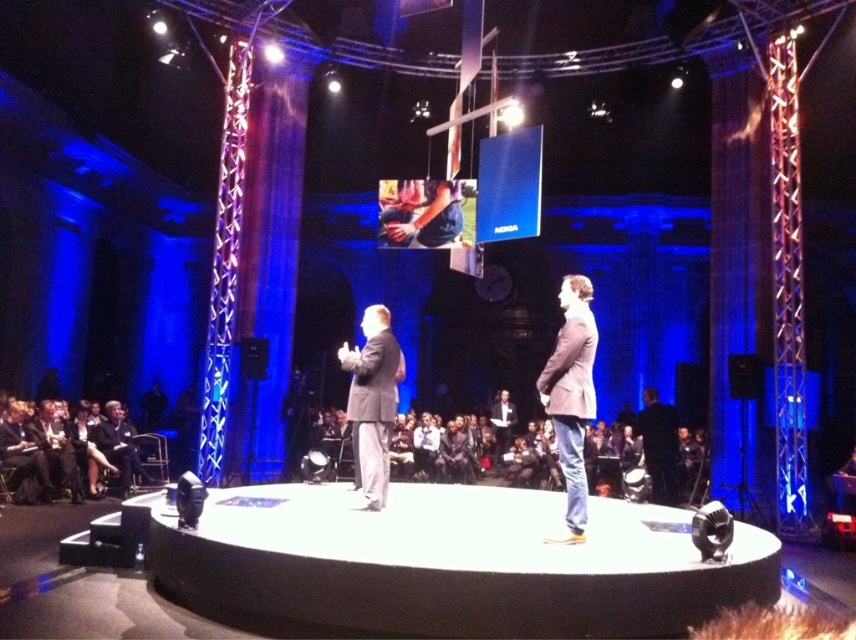
You are an event coordinator planning to place two decorative vases on the stage. You have two specific spots marked as point (566,592) and point (348,412). Which point is closer to the front edge of the stage where the presenter is standing?

Point (566,592) is closer to the viewer than point (348,412), so the vase placed at point (566,592) will be closer to the front edge of the stage where the presenter is standing.

You are standing in the auditorium and want to walk onto the white smooth stage at center. What direction should you move in to reach it?

Since the white smooth stage at center is located at coordinates approximately 0.883 on the x axis and 0.525 on the y axis, you should move forward and slightly to the right to reach it.

You are a photographer setting up for a group photo. You need to position two subjects wearing the matte gray suit at center and the denim jacket at center on the stage. Based on the scene description, which subject should you place closer to the edge of the stage to ensure both fit comfortably?

The denim jacket at center is narrower, so you should place the subject in the denim jacket at center closer to the edge of the stage to accommodate the wider matte gray suit at center in the center.